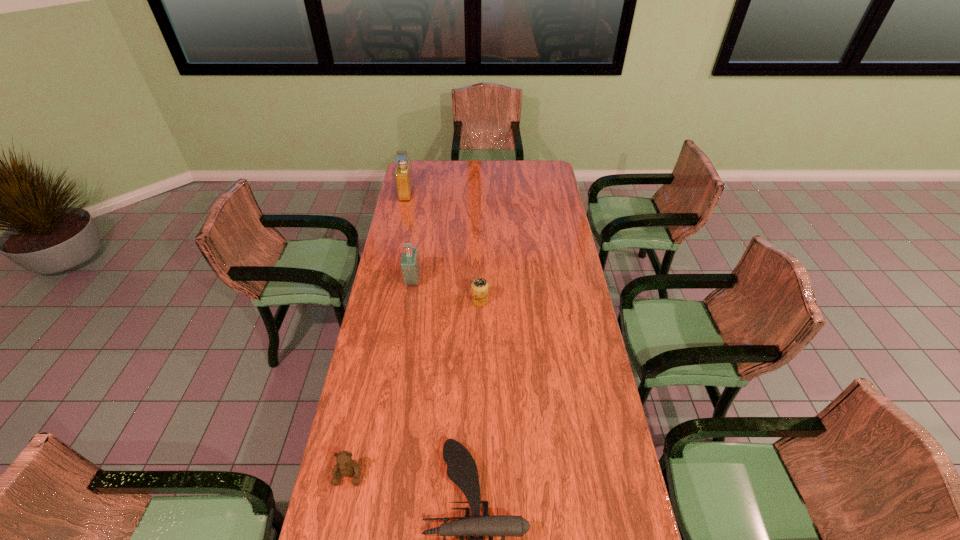
Where is `teddy bear that is at the left edge`? teddy bear that is at the left edge is located at coordinates (346, 466).

In the image, there is a desktop. Identify the location of vacant space at the left edge. The image size is (960, 540). (370, 336).

At what (x,y) coordinates should I click in order to perform the action: click on vacant space at the right edge. Please return your answer as a coordinate pair (x, y). Looking at the image, I should click on (546, 307).

Where is `vacant space at the far right corner of the desktop`? vacant space at the far right corner of the desktop is located at coordinates (533, 162).

Locate an element on the screen. Image resolution: width=960 pixels, height=540 pixels. free area in between the third farthest object and the third object from right to left is located at coordinates (446, 291).

Locate an element on the screen. The width and height of the screenshot is (960, 540). free spot between the beer can and the farthest object is located at coordinates (443, 247).

Where is `vacant space that's between the third object from right to left and the farther perfume`? vacant space that's between the third object from right to left and the farther perfume is located at coordinates (409, 237).

The height and width of the screenshot is (540, 960). Identify the location of vacant area that lies between the nearer perfume and the teddy bear. click(381, 377).

Where is `vacant area that lies between the teddy bear and the second tallest object`? vacant area that lies between the teddy bear and the second tallest object is located at coordinates (381, 377).

Find the location of a particular element. The image size is (960, 540). free space between the nearer perfume and the farthest object is located at coordinates (409, 237).